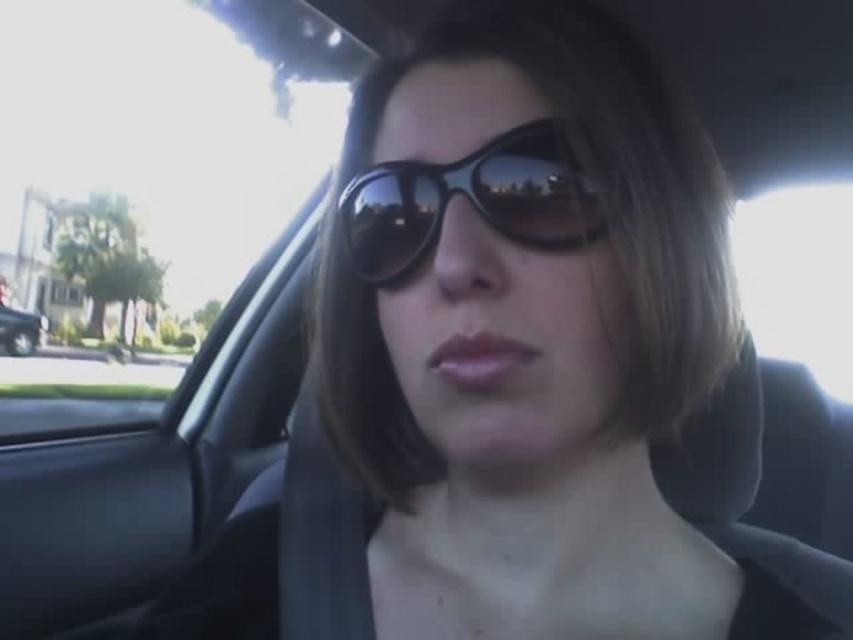
Between point (212, 189) and point (560, 144), which one is positioned in front?

Point (560, 144) is more forward.

Which of these two, transparent glass car window at upper left or black reflective sunglasses at center, stands taller?

transparent glass car window at upper left

From the picture: Who is more forward, (x=109, y=358) or (x=515, y=237)?

Point (x=515, y=237)

The image size is (853, 640). Find the location of `transparent glass car window at upper left`. transparent glass car window at upper left is located at coordinates (148, 182).

Can you confirm if transparent glass car window at upper left is positioned below metallic silver car at left?

Actually, transparent glass car window at upper left is above metallic silver car at left.

Is transparent glass car window at upper left to the right of metallic silver car at left from the viewer's perspective?

Indeed, transparent glass car window at upper left is positioned on the right side of metallic silver car at left.

Does point (231, 84) come behind point (18, 330)?

No, (231, 84) is in front of (18, 330).

The image size is (853, 640). I want to click on transparent glass car window at upper left, so click(148, 182).

Between black reflective sunglasses at center and metallic silver car at left, which one appears on the right side from the viewer's perspective?

From the viewer's perspective, black reflective sunglasses at center appears more on the right side.

Looking at this image, can you confirm if black reflective sunglasses at center is positioned above metallic silver car at left?

Yes.

I want to click on black reflective sunglasses at center, so click(x=469, y=200).

Find the location of a particular element. The width and height of the screenshot is (853, 640). black reflective sunglasses at center is located at coordinates (469, 200).